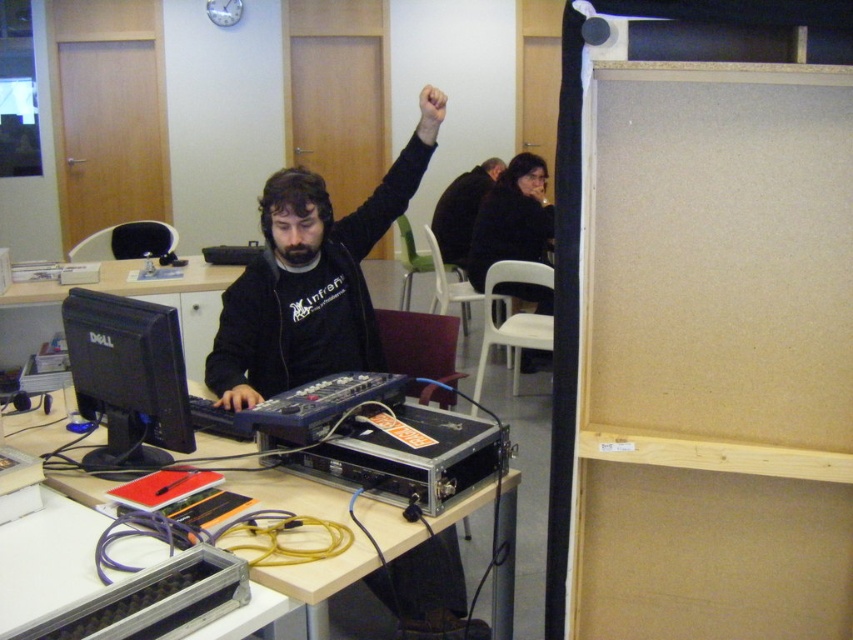
Does point (462, 196) come in front of point (235, 388)?

No, (462, 196) is behind (235, 388).

Is point (480, 186) positioned in front of point (231, 406)?

No, it is not.

Locate an element on the screen. dark brown leather jacket at upper center is located at coordinates [x=462, y=211].

Can you confirm if black matte jacket at center is positioned below black matte hand at center?

No, black matte jacket at center is not below black matte hand at center.

Is point (401, 193) positioned after point (238, 406)?

Yes.

I want to click on black matte jacket at center, so click(x=312, y=276).

From the picture: Does black matte jacket at center have a lesser height compared to dark brown leather jacket at upper center?

Incorrect, black matte jacket at center's height does not fall short of dark brown leather jacket at upper center's.

Which of these two, black matte jacket at center or dark brown leather jacket at upper center, stands taller?

black matte jacket at center

Where is `black matte jacket at center`? black matte jacket at center is located at coordinates (312, 276).